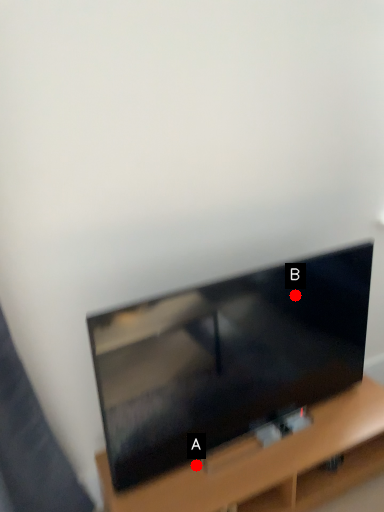
Question: Two points are circled on the image, labeled by A and B beside each circle. Among these points, which one is farthest from the camera?

Choices:
 (A) A is further
 (B) B is further

Answer: (B)